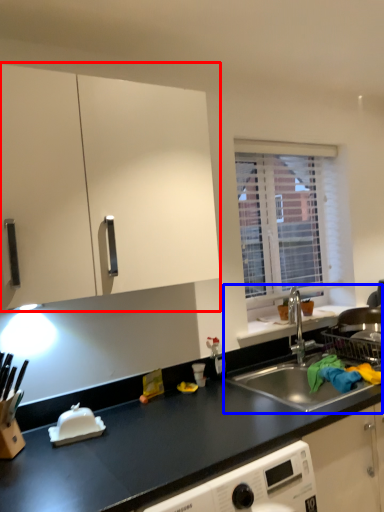
Question: Which object is closer to the camera taking this photo, cabinetry (highlighted by a red box) or sink (highlighted by a blue box)?

Choices:
 (A) cabinetry
 (B) sink

Answer: (A)